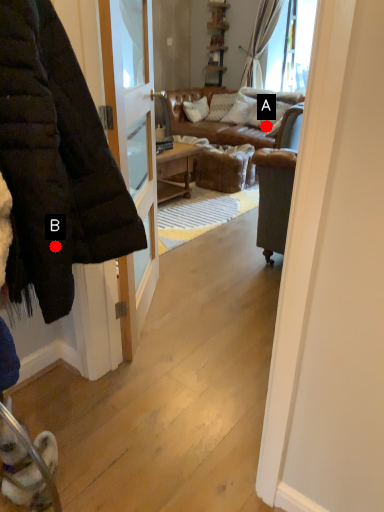
Question: Two points are circled on the image, labeled by A and B beside each circle. Which point appears farthest from the camera in this image?

Choices:
 (A) A is further
 (B) B is further

Answer: (A)